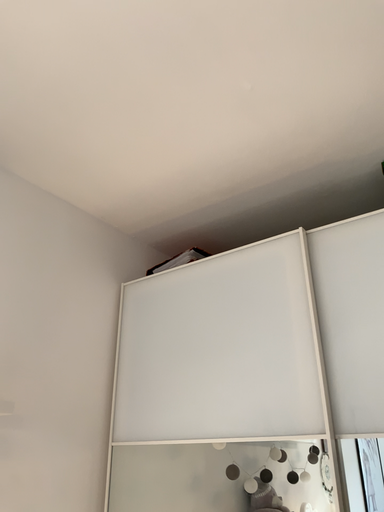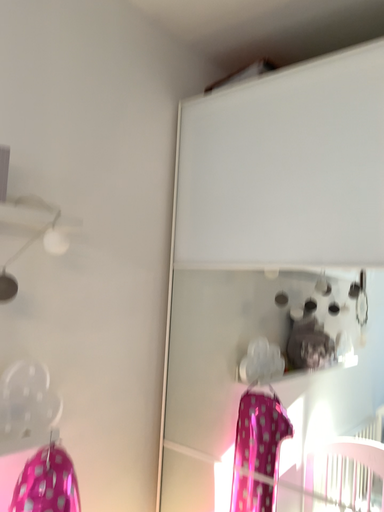
Question: Which way did the camera rotate in the video?

Choices:
 (A) rotated downward
 (B) rotated upward

Answer: (A)